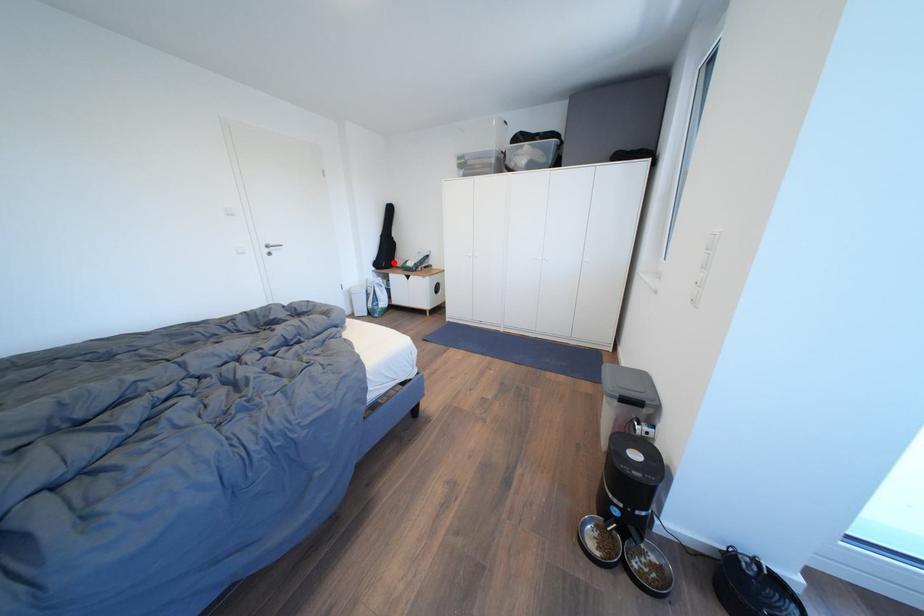
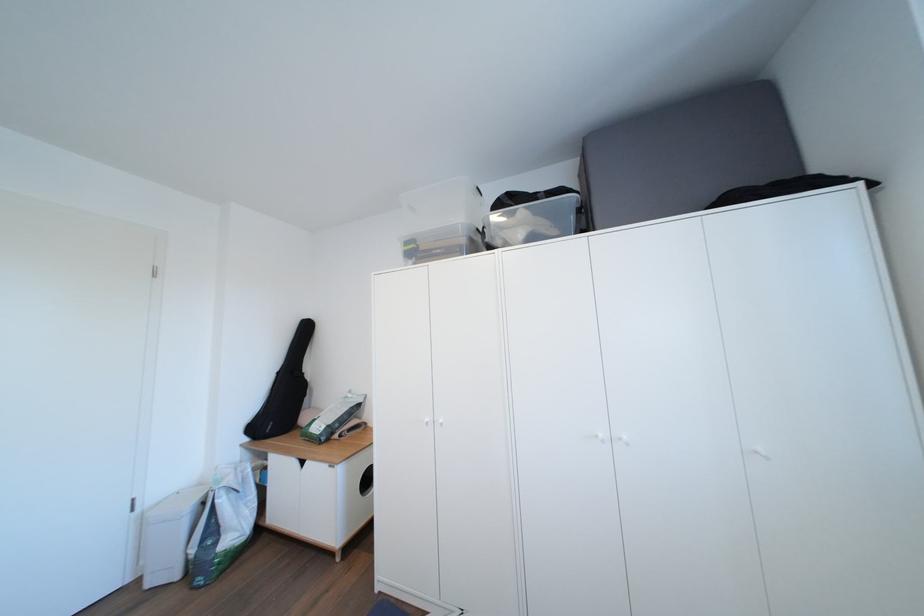
Locate, in the second image, the point that corresponds to the highlighted location in the first image.

(289, 416)